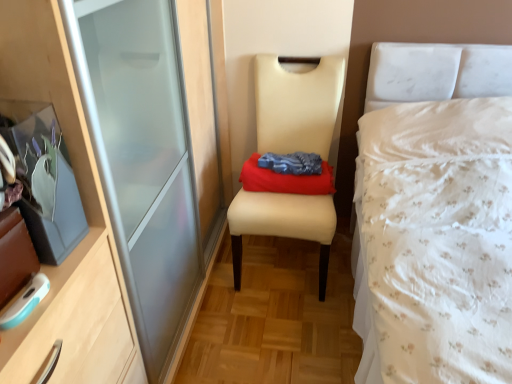
Find the location of a particular element. space that is in front of beige leather chair at center is located at coordinates (279, 332).